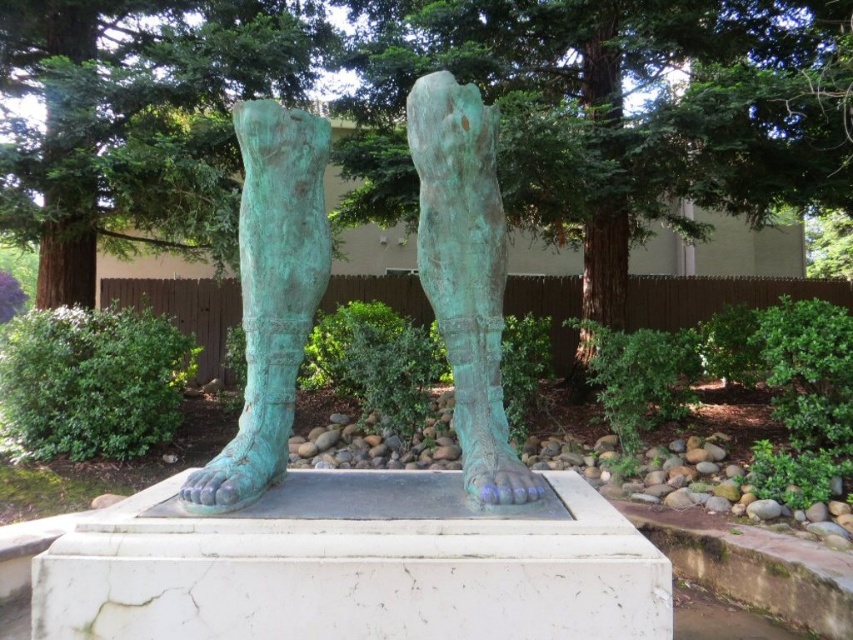
You are standing in front of the sculpture and want to touch the point at coordinates point (292,134). The sculpture is 10 feet tall. Can you reach the point without any assistance?

The point at point (292,134) is 7.07 feet from the viewer. Since the average human height is about 5.5 feet, you would need assistance to reach the point as it is higher than your reach.

You are an art conservator examining the sculpture. You notice a point at coordinates (270,294). What does this point correspond to on the sculpture?

The point at coordinates (270,294) corresponds to the green patina bronze feet at center, as indicated by the description.

Consider the image. You are an art conservator examining the sculpture. You notice the green patina leg at center and the green patina foot at center. Based on their positions, which part of the sculpture is closer to the base of the pedestal?

The green patina leg at center is located below the green patina foot at center, so the leg is closer to the base of the pedestal.